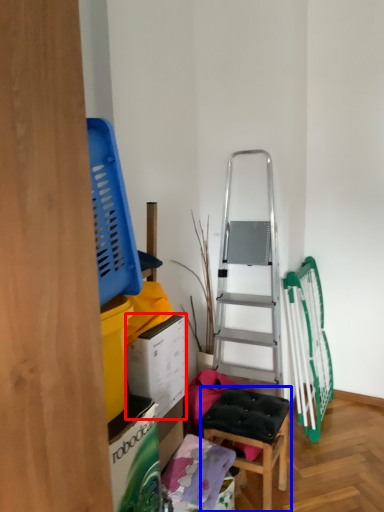
Question: Which of the following is the farthest to the observer, box (highlighted by a red box) or furniture (highlighted by a blue box)?

Choices:
 (A) box
 (B) furniture

Answer: (B)